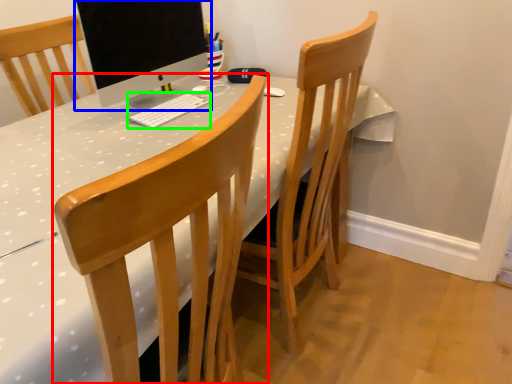
Question: Which object is positioned farthest from chair (highlighted by a red box)? Select from computer monitor (highlighted by a blue box) and computer keyboard (highlighted by a green box).

Choices:
 (A) computer monitor
 (B) computer keyboard

Answer: (A)